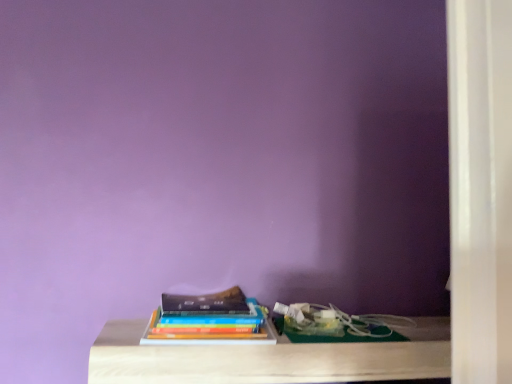
Question: Is point (234, 329) closer or farther from the camera than point (203, 377)?

Choices:
 (A) farther
 (B) closer

Answer: (A)

Question: Is hardcover books at center spatially inside light wood table at center, or outside of it?

Choices:
 (A) outside
 (B) inside

Answer: (A)

Question: Is hardcover books at center wider or thinner than light wood table at center?

Choices:
 (A) wide
 (B) thin

Answer: (B)

Question: Considering the positions of point (381, 357) and point (174, 329), is point (381, 357) closer or farther from the camera than point (174, 329)?

Choices:
 (A) farther
 (B) closer

Answer: (A)

Question: From their relative heights in the image, would you say light wood table at center is taller or shorter than hardcover books at center?

Choices:
 (A) short
 (B) tall

Answer: (A)

Question: From the image's perspective, is light wood table at center positioned above or below hardcover books at center?

Choices:
 (A) above
 (B) below

Answer: (B)

Question: Based on their sizes in the image, would you say light wood table at center is bigger or smaller than hardcover books at center?

Choices:
 (A) big
 (B) small

Answer: (A)